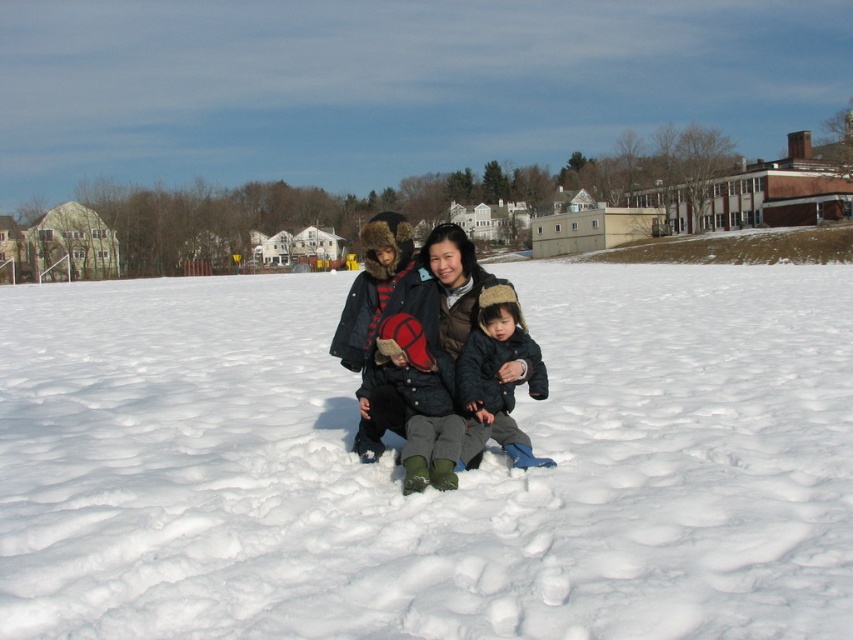
You are planning to build a snowman using the white fluffy snow at center and the fluffy gray hat at center. Which object should you choose for the snowman base?

The white fluffy snow at center is bigger than the fluffy gray hat at center, so it should be used for the snowman base because a larger amount of snow is needed for the base.

You are a drone operator trying to capture a photo of the scene. The drone is currently hovering 15 meters above the ground. If you want to ensure both the white fluffy snow at center and the matte black jacket at center are in the same frame, will the drone need to adjust its altitude? Explain your reasoning.

The distance between the white fluffy snow at center and the matte black jacket at center is 12.33 meters. Since the drone is already hovering at 15 meters above the ground, which is higher than the separation between the two objects, the drone does not need to adjust its altitude to include both in the same frame.